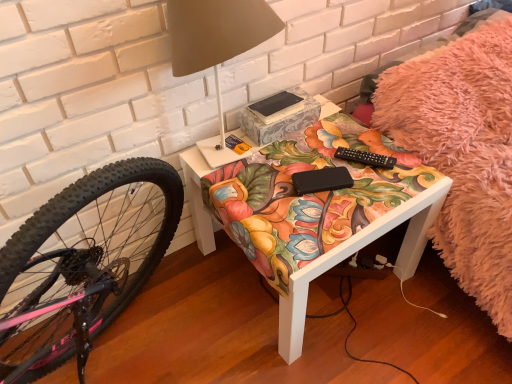
Image resolution: width=512 pixels, height=384 pixels. What do you see at coordinates (216, 36) in the screenshot?
I see `matte white table lamp at upper center` at bounding box center [216, 36].

Where is `matte white table lamp at upper center`? The image size is (512, 384). matte white table lamp at upper center is located at coordinates (216, 36).

Looking at this image, is matte floral-patterned table at center to the right of matte white table lamp at upper center from the viewer's perspective?

Yes, matte floral-patterned table at center is to the right of matte white table lamp at upper center.

Is there a large distance between matte floral-patterned table at center and matte white table lamp at upper center?

That's not correct — matte floral-patterned table at center is a little close to matte white table lamp at upper center.

How much distance is there between matte floral-patterned table at center and matte white table lamp at upper center?

matte floral-patterned table at center is 23.28 inches away from matte white table lamp at upper center.

Is matte white table lamp at upper center to the left or to the right of black matte book at center in the image?

In the image, matte white table lamp at upper center appears on the left side of black matte book at center.

Which object is closer to the camera, matte white table lamp at upper center or black matte book at center?

matte white table lamp at upper center is in front.

Can you confirm if matte white table lamp at upper center is smaller than black matte book at center?

No, matte white table lamp at upper center is not smaller than black matte book at center.

In order to click on table lamp above the black matte book at center (from the image's perspective) in this screenshot , I will do `click(216, 36)`.

Does matte floral-patterned table at center have a lesser height compared to black matte book at center?

No.

I want to click on book above the matte floral-patterned table at center (from a real-world perspective), so click(x=277, y=107).

Considering the points (408, 275) and (302, 103), which point is in front, point (408, 275) or point (302, 103)?

The point (302, 103) is more forward.

Consider the image. Can you see matte floral-patterned table at center touching black matte book at center?

They are not placed beside each other.

From the image's perspective, which is below, black matte book at center or matte floral-patterned table at center?

matte floral-patterned table at center, from the image's perspective.

Can you confirm if black matte book at center is taller than matte floral-patterned table at center?

No.

Could you tell me if black matte book at center is turned towards matte floral-patterned table at center?

No, black matte book at center is not oriented towards matte floral-patterned table at center.

Is black matte book at center surrounding matte floral-patterned table at center?

That's incorrect, matte floral-patterned table at center is not inside black matte book at center.

From the image's perspective, would you say matte white table lamp at upper center is shown under matte floral-patterned table at center?

No, from the image's perspective, matte white table lamp at upper center is not below matte floral-patterned table at center.

The image size is (512, 384). What are the coordinates of `table lamp that is above the matte floral-patterned table at center (from the image's perspective)` in the screenshot? It's located at (216, 36).

In terms of height, does matte white table lamp at upper center look taller or shorter compared to matte floral-patterned table at center?

matte white table lamp at upper center is taller than matte floral-patterned table at center.

In the image, is matte white table lamp at upper center positioned in front of or behind matte floral-patterned table at center?

Visually, matte white table lamp at upper center is located in front of matte floral-patterned table at center.

From a real-world perspective, who is located higher, black matte book at center or matte white table lamp at upper center?

matte white table lamp at upper center is physically above.

Based on their sizes in the image, would you say black matte book at center is bigger or smaller than matte white table lamp at upper center?

Considering their sizes, black matte book at center takes up less space than matte white table lamp at upper center.

From the image's perspective, which object appears higher, black matte book at center or matte white table lamp at upper center?

matte white table lamp at upper center is shown above in the image.

Considering the relative sizes of black matte book at center and matte white table lamp at upper center in the image provided, is black matte book at center taller than matte white table lamp at upper center?

No.

Locate an element on the screen. The width and height of the screenshot is (512, 384). table that is on the right side of matte white table lamp at upper center is located at coordinates (356, 251).

This screenshot has height=384, width=512. In order to click on book below the matte white table lamp at upper center (from a real-world perspective) in this screenshot , I will do `click(277, 107)`.

Looking at the image, which one is located further to matte floral-patterned table at center, black matte book at center or matte white table lamp at upper center?

Among the two, matte white table lamp at upper center is located further to matte floral-patterned table at center.

Which object lies nearer to the anchor point matte floral-patterned table at center, matte white table lamp at upper center or black matte book at center?

The object closer to matte floral-patterned table at center is black matte book at center.

Based on their spatial positions, is black matte book at center or matte floral-patterned table at center closer to matte white table lamp at upper center?

black matte book at center is closer to matte white table lamp at upper center.

Estimate the real-world distances between objects in this image. Which object is closer to black matte book at center, matte floral-patterned table at center or matte white table lamp at upper center?

matte white table lamp at upper center.

In the scene shown: Which object lies nearer to the anchor point matte white table lamp at upper center, matte floral-patterned table at center or black matte book at center?

black matte book at center is closer to matte white table lamp at upper center.

Estimate the real-world distances between objects in this image. Which object is closer to black matte book at center, matte white table lamp at upper center or matte floral-patterned table at center?

matte white table lamp at upper center is positioned closer to the anchor black matte book at center.

The width and height of the screenshot is (512, 384). In order to click on table located between matte white table lamp at upper center and black matte book at center in the depth direction in this screenshot , I will do `click(356, 251)`.